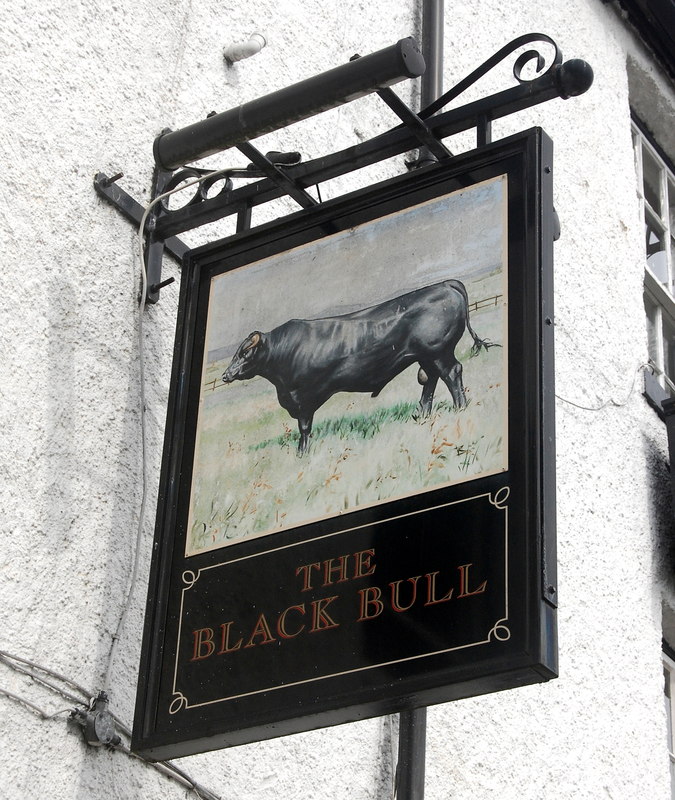
The width and height of the screenshot is (675, 800). In order to click on window in this screenshot , I will do `click(657, 178)`.